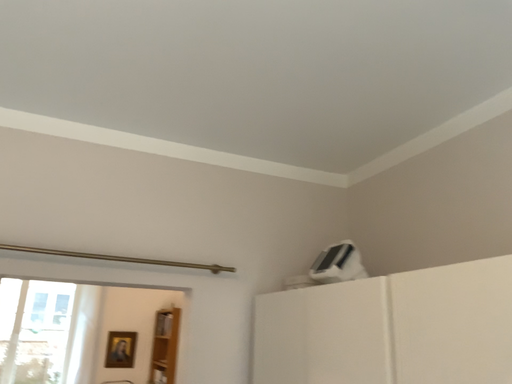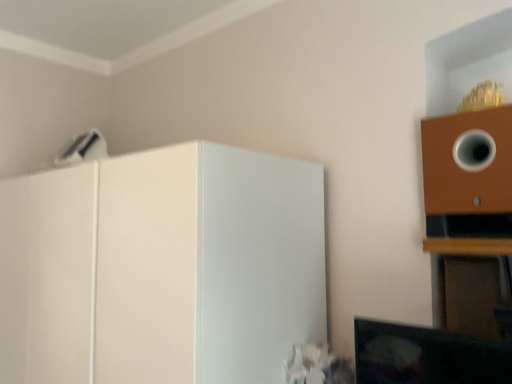
Question: How did the camera likely rotate when shooting the video?

Choices:
 (A) rotated downward
 (B) rotated upward

Answer: (A)